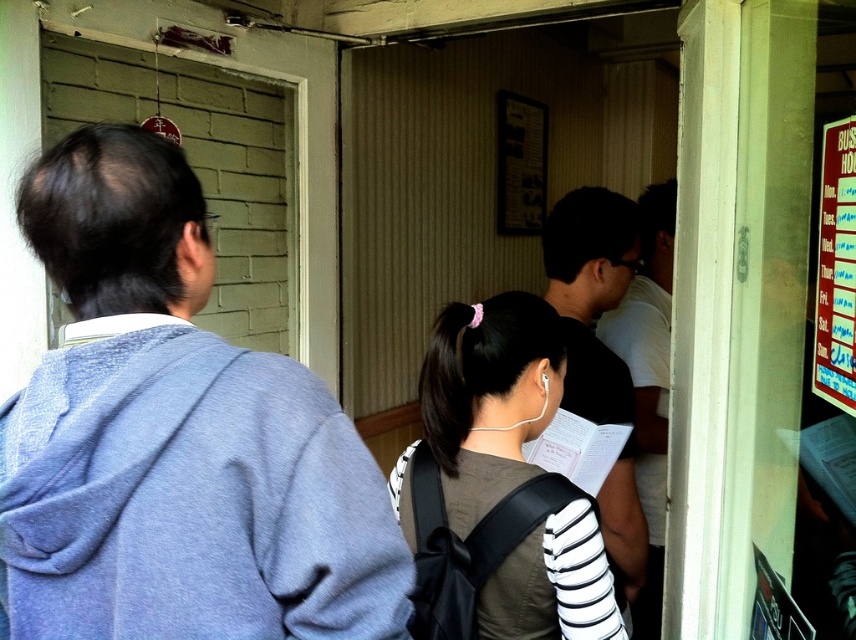
You are trying to read the text on the red plastic signboard at right but the dark gray shirt at center is blocking your view. Can you see the signboard clearly?

The dark gray shirt at center is much taller than the red plastic signboard at right, so it is blocking the view of the signboard.

You are standing in an entrance area and need to reach the notice board on your right. There are two people blocking your view of the board. The first person has dark brown hair at center and the second has a dark gray shirt at center. Which person is closer to you so you can ask to move?

The dark brown hair at center is closer to you than the dark gray shirt at center since they are 24.86 inches apart, so you should ask the person with dark brown hair at center to move first.

You are standing in an entrance area near a notice board with a red background. You need to find the dark brown hair at center. Based on its coordinates, can you determine if it is closer to the notice board or the entrance?

The dark brown hair at center is located at point (497, 486). Since the notice board is on the right side of the scene, the coordinates suggest it is closer to the entrance rather than the notice board.